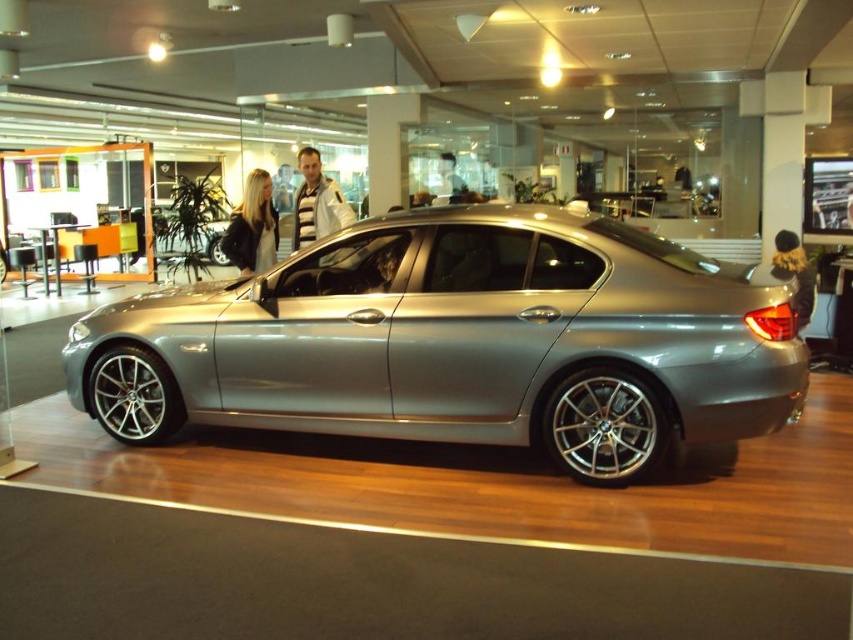
Question: Estimate the real-world distances between objects in this image. Which object is closer to the satin metallic car at center?

Choices:
 (A) striped sweater at center
 (B) velvet gold jacket at center
 (C) dark brown leather jacket at center

Answer: (A)

Question: Among these objects, which one is farthest from the camera?

Choices:
 (A) satin metallic car at center
 (B) striped sweater at center
 (C) velvet gold jacket at center

Answer: (B)

Question: Considering the relative positions of satin metallic car at center and velvet gold jacket at center in the image provided, where is satin metallic car at center located with respect to velvet gold jacket at center?

Choices:
 (A) above
 (B) below

Answer: (B)

Question: Estimate the real-world distances between objects in this image. Which object is farther from the dark brown leather jacket at center?

Choices:
 (A) velvet gold jacket at center
 (B) satin metallic car at center
 (C) striped sweater at center

Answer: (A)

Question: Is satin metallic car at center behind striped sweater at center?

Choices:
 (A) no
 (B) yes

Answer: (A)

Question: Is satin metallic car at center below dark brown leather jacket at center?

Choices:
 (A) yes
 (B) no

Answer: (A)